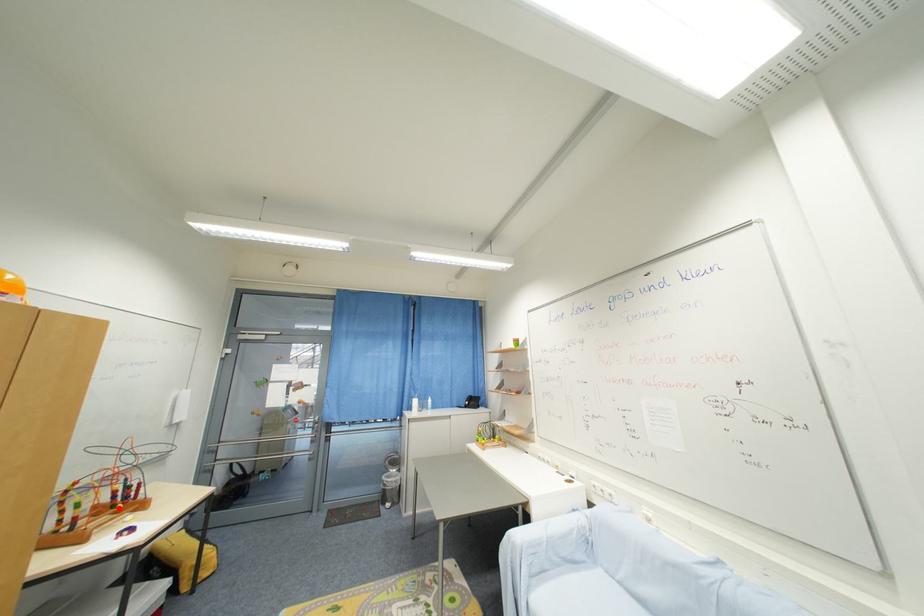
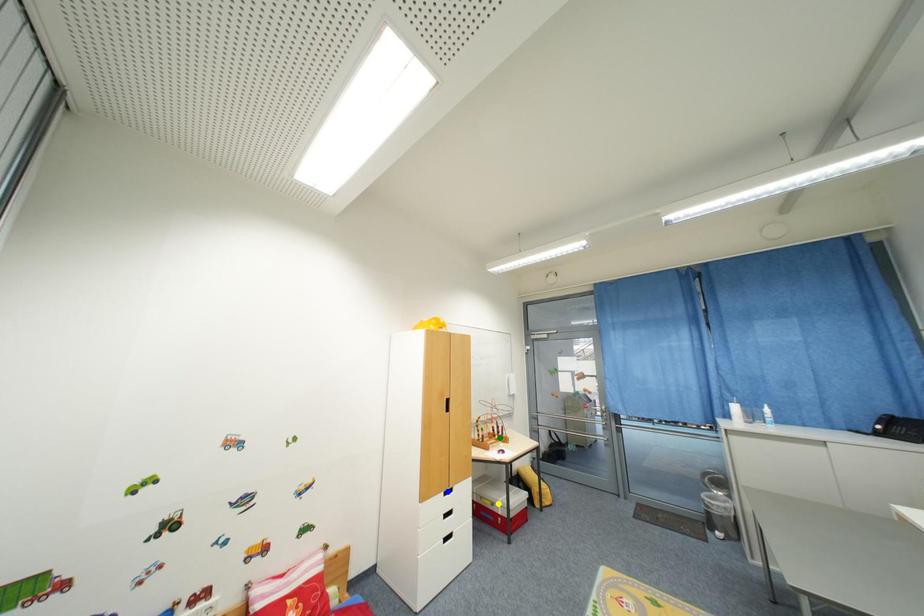
Question: I am providing you with two images of the same scene from different viewpoints. A red point is marked on the first image. You are given multiple points on the second image. Which point in image 2 represents the same 3d spot as the red point in image 1?

Choices:
 (A) blue point
 (B) yellow point
 (C) green point

Answer: (C)